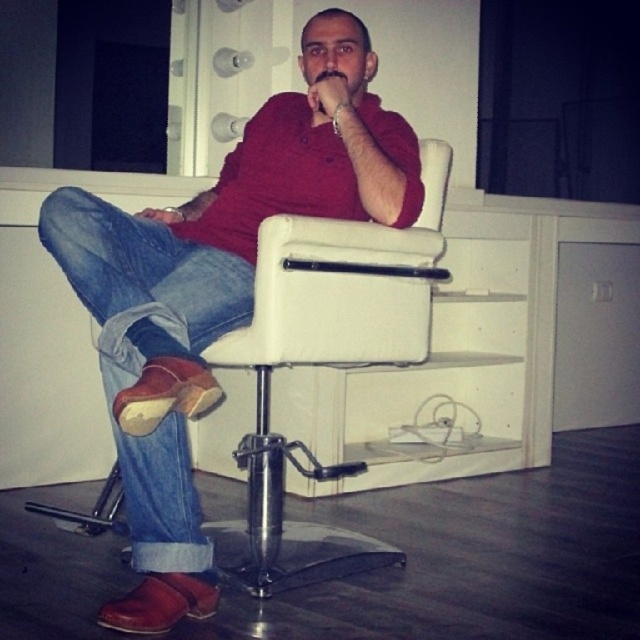
You are a tailor measuring a customer for a new suit. You need to compare the width of the suede leather shoes at center and the blue denim jeans at lower left to ensure proper fitting. Which item is wider?

The suede leather shoes at center are wider than the blue denim jeans at lower left according to the description provided.

In the scene, there is a man sitting in a barber chair. He is wearing suede leather shoes at center and blue denim jeans at lower left. Which of these items is positioned to the right when viewed from the front?

The suede leather shoes at center are to the right of the blue denim jeans at lower left.

From the picture: You are a delivery person standing in front of the barber chair scene. You need to place a small package on the floor near the suede leather shoes at center. Considering your height is 1.7 meters, can you comfortably reach the floor to place the package without bending too much?

The suede leather shoes at center are 1.46 meters away from the viewer. Since the delivery person is 1.7 meters tall, they can comfortably reach the floor to place the package near the suede leather shoes at center without needing to bend excessively.